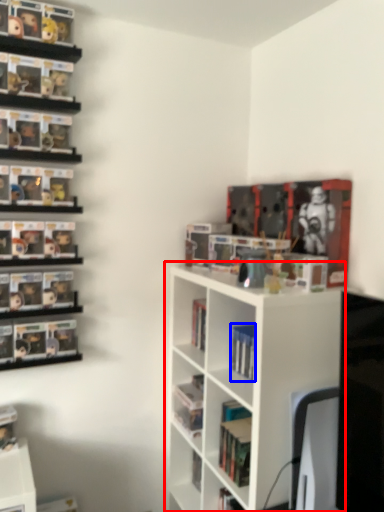
Question: Which of the following is the closest to the observer, shelf (highlighted by a red box) or book (highlighted by a blue box)?

Choices:
 (A) shelf
 (B) book

Answer: (A)